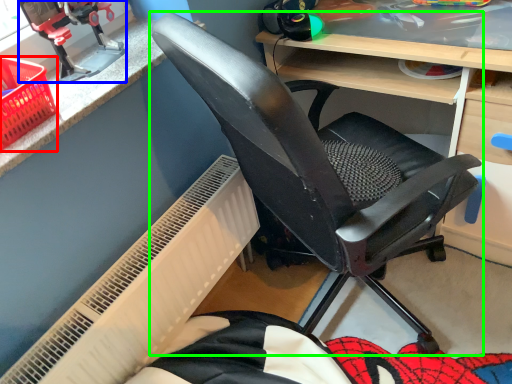
Question: Which object is the closest to the basket (highlighted by a red box)? Choose among these: sport equipment (highlighted by a blue box) or chair (highlighted by a green box).

Choices:
 (A) sport equipment
 (B) chair

Answer: (A)